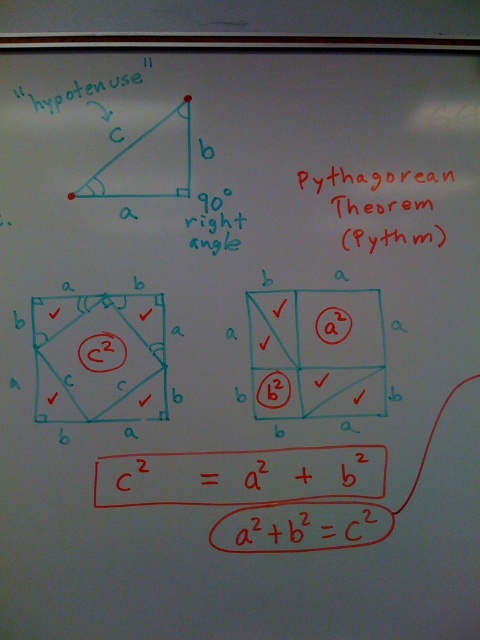
Question: Does matte blue square at center lie in front of red matte pythagorean theorem at upper right?

Choices:
 (A) no
 (B) yes

Answer: (B)

Question: Which is nearer to the red matte pythagorean theorem at upper right?

Choices:
 (A) matte blue square at center
 (B) blue marker text at center

Answer: (B)

Question: Is matte blue square at center in front of red matte pythagorean theorem at upper right?

Choices:
 (A) no
 (B) yes

Answer: (B)

Question: Can you confirm if matte blue square at center is positioned to the left of red matte pythagorean theorem at upper right?

Choices:
 (A) yes
 (B) no

Answer: (A)

Question: Which of the following is the closest to the observer?

Choices:
 (A) (93, 316)
 (B) (200, 227)
 (C) (311, 180)

Answer: (A)

Question: Based on their relative distances, which object is farther from the matte blue square at center?

Choices:
 (A) red matte pythagorean theorem at upper right
 (B) blue marker text at center

Answer: (A)